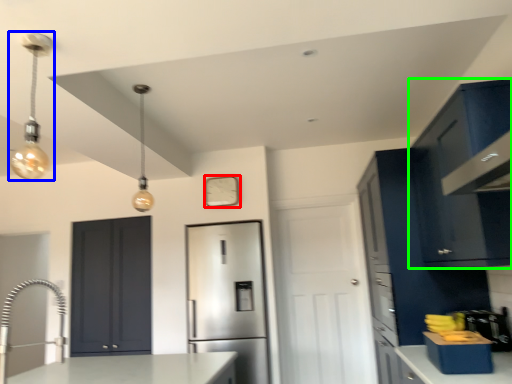
Question: Which object is the closest to the clock (highlighted by a red box)? Choose among these: light fixture (highlighted by a blue box) or cabinetry (highlighted by a green box).

Choices:
 (A) light fixture
 (B) cabinetry

Answer: (A)